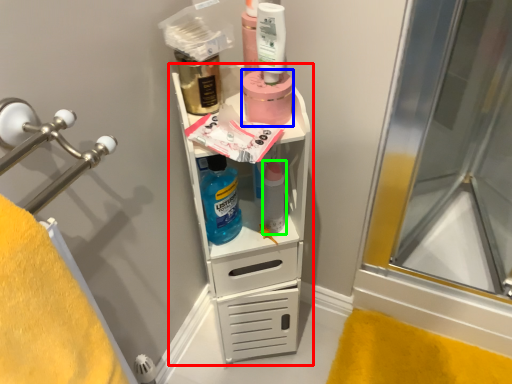
Question: Based on their relative distances, which object is farther from bathroom cabinet (highlighted by a red box)? Choose from product (highlighted by a blue box) and toiletry (highlighted by a green box).

Choices:
 (A) product
 (B) toiletry

Answer: (A)